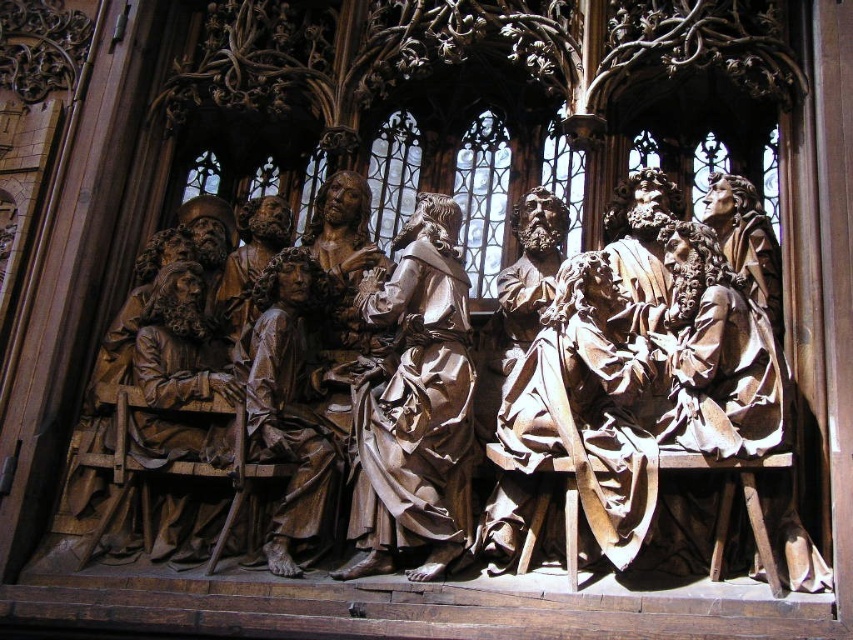
Locate an element on the screen. Image resolution: width=853 pixels, height=640 pixels. polished wood figure at center is located at coordinates (415, 404).

Is point (366, 392) closer to camera compared to point (613, 451)?

No.

I want to click on polished wood figure at center, so click(x=415, y=404).

Between brown wood statue at center and brown wood statue at left, which one is positioned lower?

brown wood statue at center

Where is `brown wood statue at center`? brown wood statue at center is located at coordinates (289, 412).

Locate an element on the screen. The width and height of the screenshot is (853, 640). brown wood statue at center is located at coordinates (289, 412).

Is point (434, 484) closer to viewer compared to point (142, 358)?

That is True.

What are the coordinates of `brown wood carving of figures at center` in the screenshot? It's located at (538, 394).